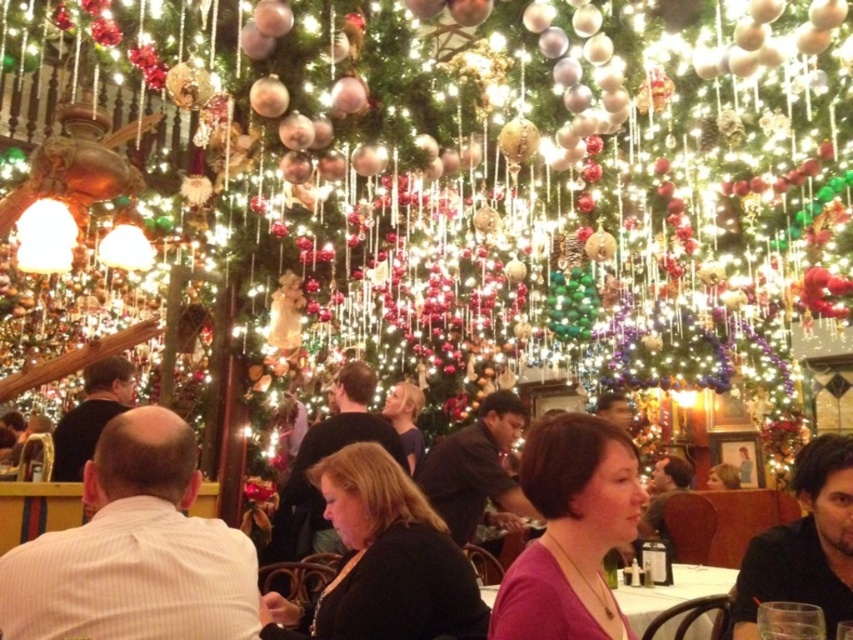
Who is positioned more to the left, purple matte shirt at center or pink fabric table at lower center?

From the viewer's perspective, purple matte shirt at center appears more on the left side.

Between purple matte shirt at center and pink fabric table at lower center, which one is positioned lower?

pink fabric table at lower center is below.

You are a GUI agent. You are given a task and a screenshot of the screen. Output one action in this format:
    pyautogui.click(x=<x>, y=<y>)
    Task: Click on the purple matte shirt at center
    The width and height of the screenshot is (853, 640).
    Given the screenshot: What is the action you would take?
    pyautogui.click(x=570, y=531)

Can you confirm if white striped shirt at center is thinner than pink fabric table at lower center?

Correct, white striped shirt at center's width is less than pink fabric table at lower center's.

Can you confirm if white striped shirt at center is positioned above pink fabric table at lower center?

Correct, white striped shirt at center is located above pink fabric table at lower center.

Image resolution: width=853 pixels, height=640 pixels. I want to click on white striped shirt at center, so click(x=134, y=550).

The image size is (853, 640). I want to click on white striped shirt at center, so click(134, 550).

Who is lower down, white striped shirt at center or purple matte shirt at center?

white striped shirt at center is below.

Can you confirm if white striped shirt at center is positioned to the left of purple matte shirt at center?

Correct, you'll find white striped shirt at center to the left of purple matte shirt at center.

Is point (202, 544) positioned after point (581, 586)?

No, (202, 544) is in front of (581, 586).

Locate an element on the screen. white striped shirt at center is located at coordinates (134, 550).